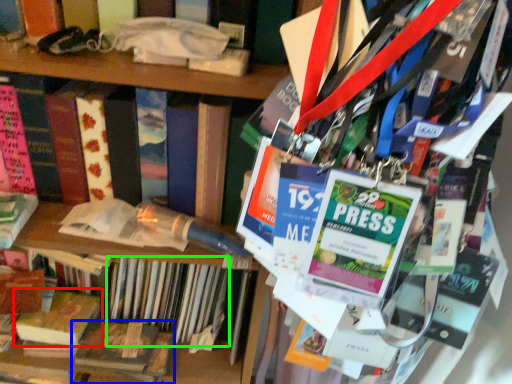
Question: Considering the real-world distances, which object is closest to book (highlighted by a red box)? book (highlighted by a blue box) or book (highlighted by a green box).

Choices:
 (A) book
 (B) book

Answer: (A)